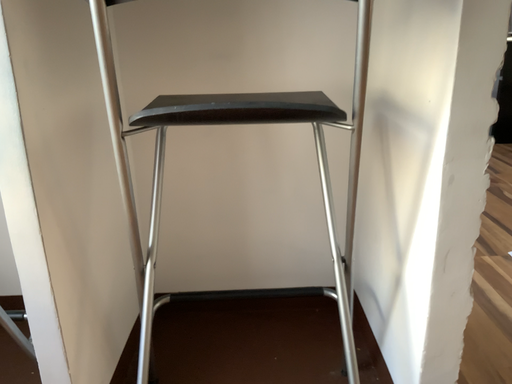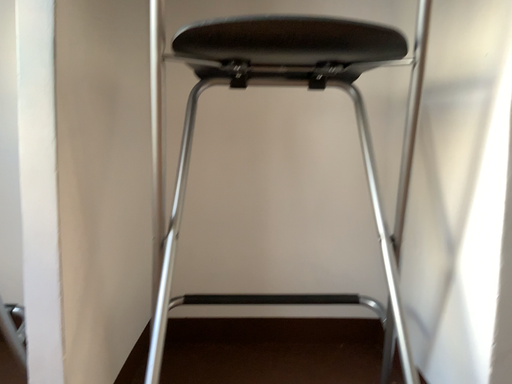
Question: Which way did the camera rotate in the video?

Choices:
 (A) rotated upward
 (B) rotated downward

Answer: (A)